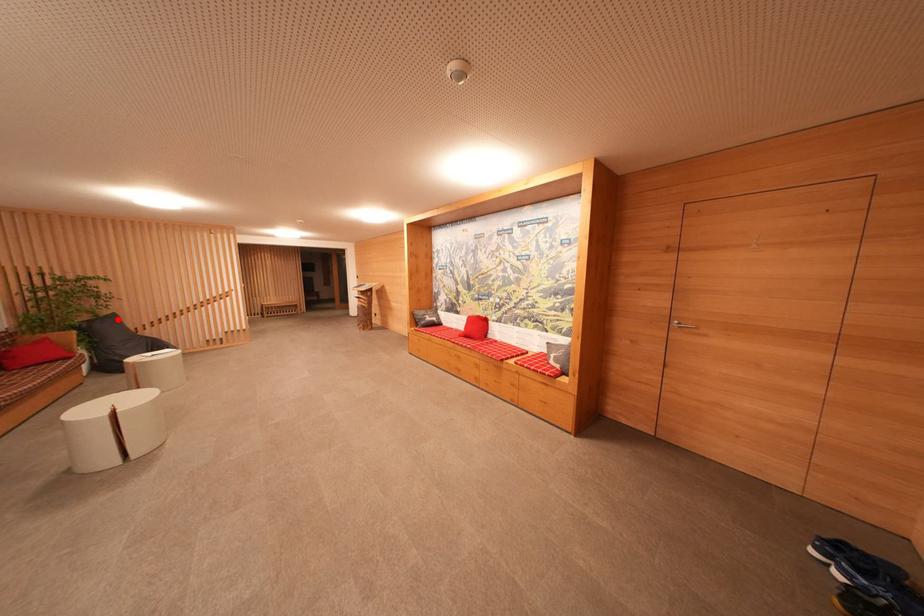
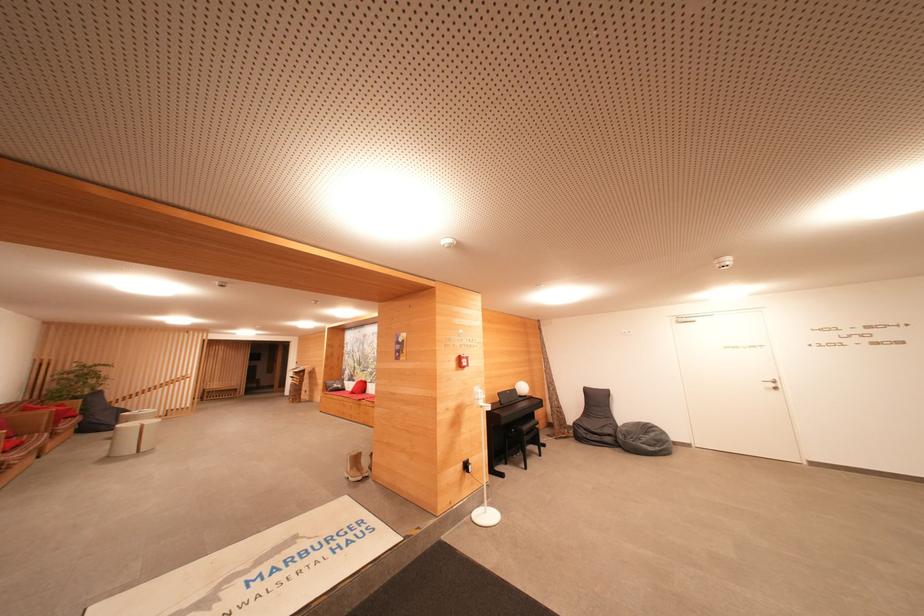
Question: I am providing you with two images of the same scene from different viewpoints. Image1 has a red point marked. In image2, the corresponding 3D location appears at what relative position? Reply with the corresponding letter.

Choices:
 (A) Closer
 (B) Farther

Answer: (A)